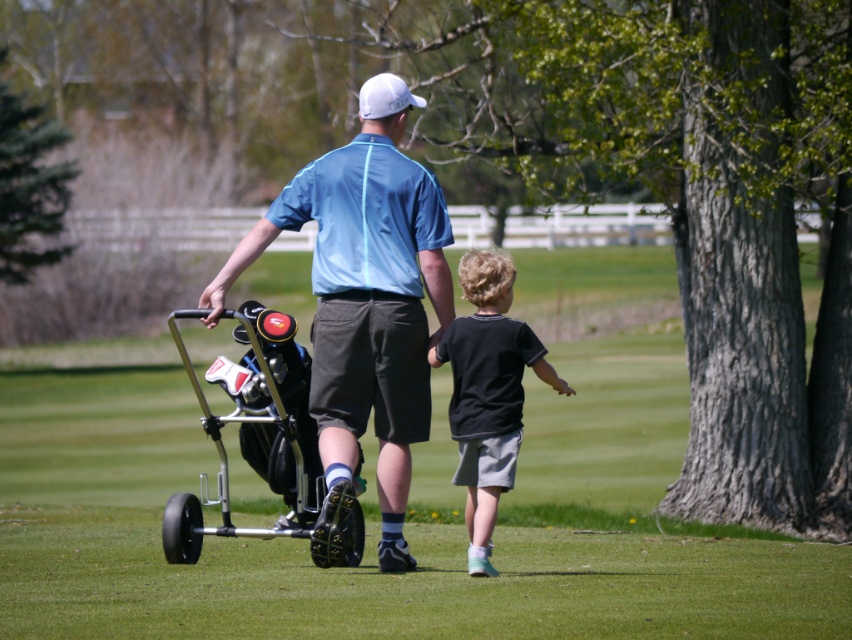
Question: Estimate the real-world distances between objects in this image. Which object is closer to the metallic silver golf cart at center?

Choices:
 (A) green grass at center
 (B) matte blue shirt at center
 (C) black cotton shirt at center

Answer: (C)

Question: Is metallic silver golf cart at center bigger than black cotton shirt at center?

Choices:
 (A) yes
 (B) no

Answer: (B)

Question: Which point is farther to the camera?

Choices:
 (A) (389, 394)
 (B) (563, 456)
 (C) (285, 467)
 (D) (440, 348)

Answer: (B)

Question: Which point is farther to the camera?

Choices:
 (A) (371, 129)
 (B) (242, 417)

Answer: (B)

Question: Is green grass at center above black cotton shirt at center?

Choices:
 (A) yes
 (B) no

Answer: (B)

Question: Is green grass at center thinner than metallic silver golf cart at center?

Choices:
 (A) no
 (B) yes

Answer: (A)